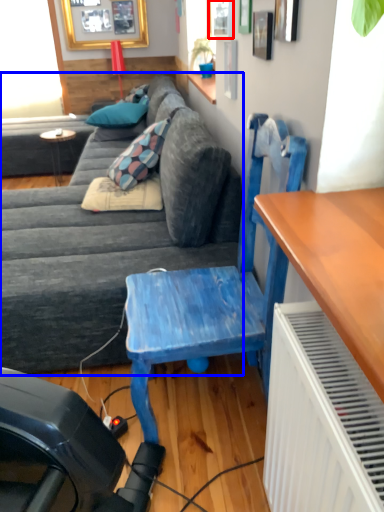
Question: Which point is further to the camera, window (highlighted by a red box) or studio couch (highlighted by a blue box)?

Choices:
 (A) window
 (B) studio couch

Answer: (A)